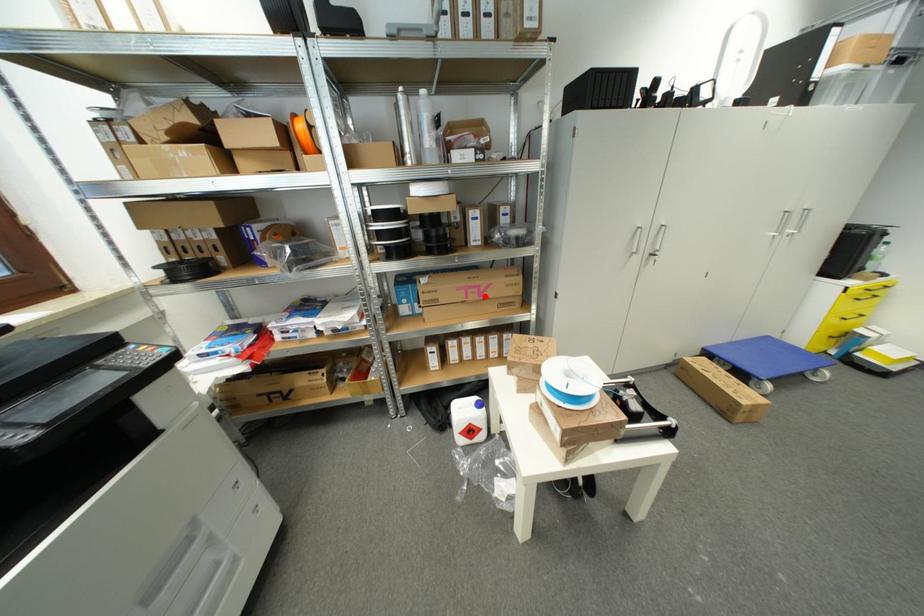
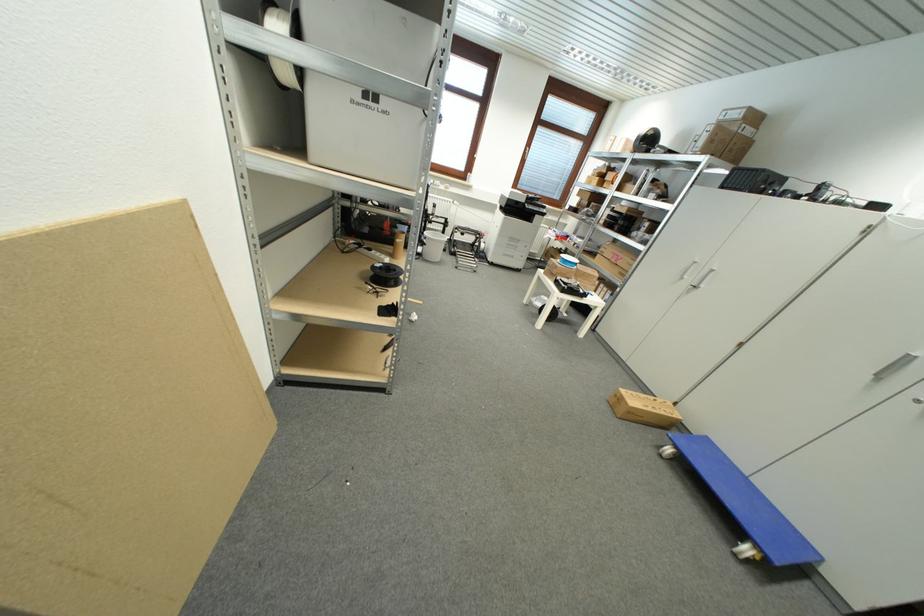
The point at the highlighted location is marked in the first image. Where is the corresponding point in the second image?

(621, 262)